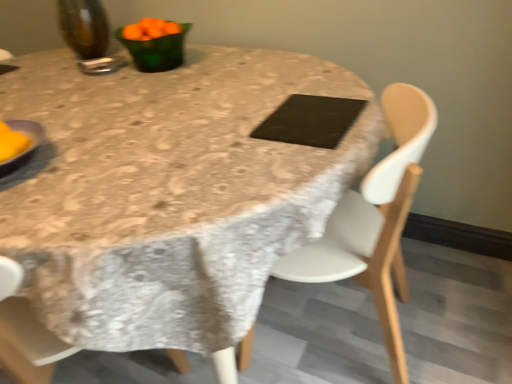
You are a GUI agent. You are given a task and a screenshot of the screen. Output one action in this format:
    pyautogui.click(x=<x>, y=<y>)
    Task: Click on the vacant area that lies in front of green glass bowl at upper left, the first tableware in the right-to-left sequence
    Image resolution: width=512 pixels, height=384 pixels.
    Given the screenshot: What is the action you would take?
    pyautogui.click(x=157, y=81)